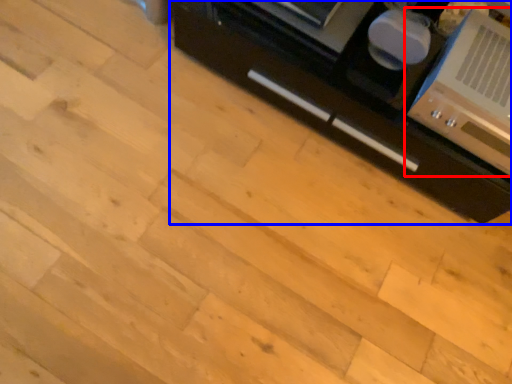
Question: Which object is closer to the camera taking this photo, home appliance (highlighted by a red box) or cabinetry (highlighted by a blue box)?

Choices:
 (A) home appliance
 (B) cabinetry

Answer: (A)